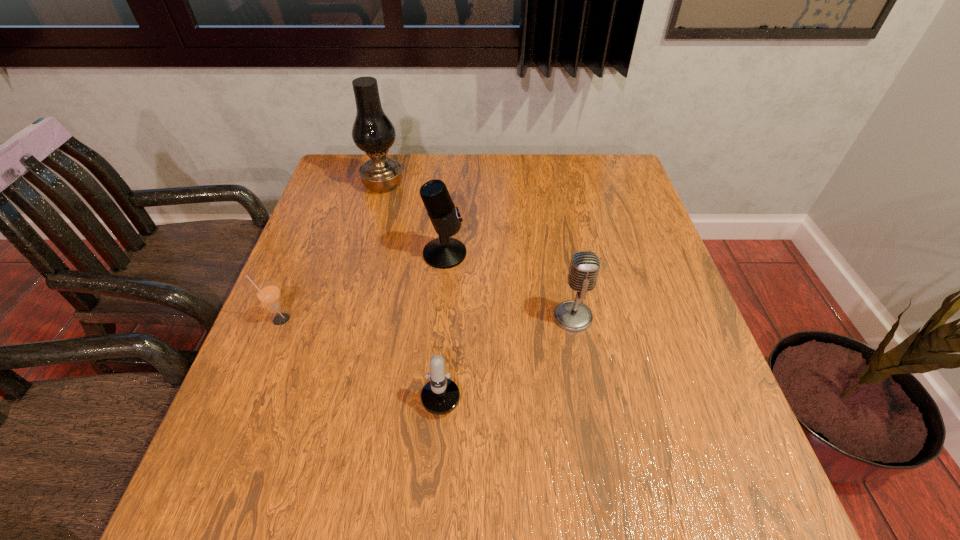
Locate an element on the screen. This screenshot has height=540, width=960. free space between the rightmost object and the nearest object is located at coordinates (508, 347).

Identify the location of free space between the leftmost object and the nearest microphone. click(361, 348).

Locate an element on the screen. This screenshot has height=540, width=960. vacant space in between the shortest microphone and the leftmost object is located at coordinates tap(361, 348).

Choose which object is the nearest neighbor to the rightmost microphone. Please provide its 2D coordinates. Your answer should be formatted as a tuple, i.e. [(x, y)], where the tuple contains the x and y coordinates of a point satisfying the conditions above.

[(439, 396)]

The image size is (960, 540). Find the location of `object that stands as the fourth closest to the oil lamp`. object that stands as the fourth closest to the oil lamp is located at coordinates (571, 315).

Identify which microphone is located as the second nearest to the rightmost microphone. Please provide its 2D coordinates. Your answer should be formatted as a tuple, i.e. [(x, y)], where the tuple contains the x and y coordinates of a point satisfying the conditions above.

[(444, 252)]

Locate which microphone is the third closest to the leftmost object. Please provide its 2D coordinates. Your answer should be formatted as a tuple, i.e. [(x, y)], where the tuple contains the x and y coordinates of a point satisfying the conditions above.

[(571, 315)]

Where is `free space that satisfies the following two spatial constraints: 1. on the stand of the rightmost object; 2. on the right side of the fourth nearest object`? Image resolution: width=960 pixels, height=540 pixels. free space that satisfies the following two spatial constraints: 1. on the stand of the rightmost object; 2. on the right side of the fourth nearest object is located at coordinates (440, 317).

Where is `vacant space that satisfies the following two spatial constraints: 1. on the back side of the shortest microphone; 2. on the right side of the rightmost object`? The width and height of the screenshot is (960, 540). vacant space that satisfies the following two spatial constraints: 1. on the back side of the shortest microphone; 2. on the right side of the rightmost object is located at coordinates (446, 317).

I want to click on blank area in the image that satisfies the following two spatial constraints: 1. on the back side of the farthest object; 2. on the right side of the leftmost object, so click(x=334, y=184).